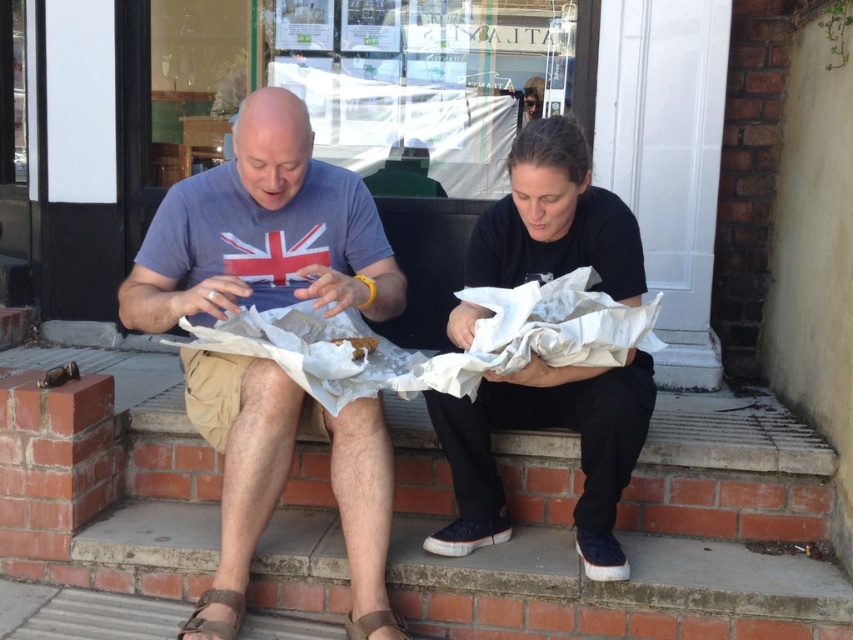
You are standing at the point labeled point (560,365) and want to walk to the glass door in the background. Which direction should you move relative to the point (372,624)?

Since point (560,365) is in front of point (372,624), you should move away from point (372,624) towards the glass door in the background.

You are standing at the bottom of the image and want to place a small object exactly at the point where the brown leather sandal at lower left is located. What are the coordinates of this point?

The coordinates for the brown leather sandal at lower left are 0.970 in the x direction and 0.254 in the y direction.